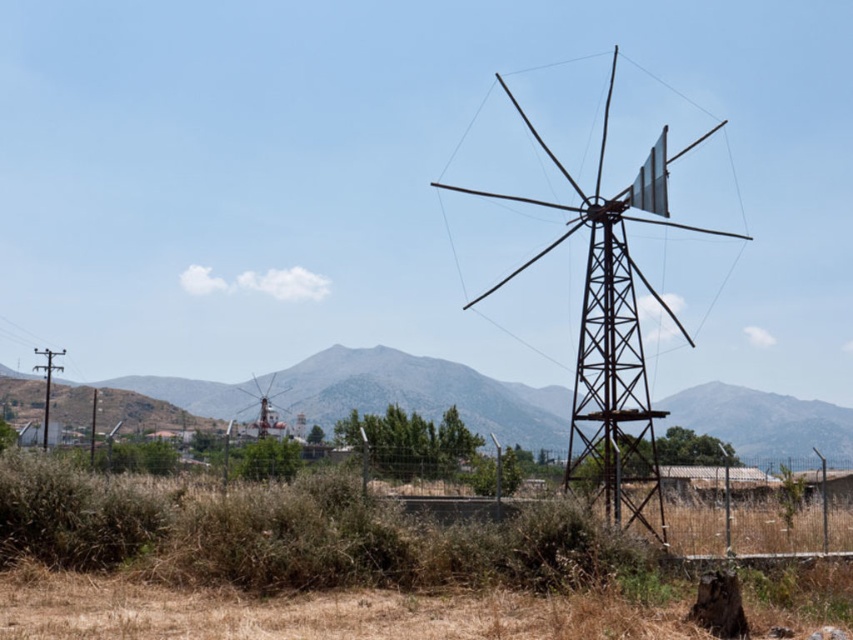
In the scene shown: You are standing at the edge of the scene and want to estimate the relative widths of the rustic stone mountain at center and the rusty metal windmill at center. Based on the information provided, which object is wider?

The rustic stone mountain at center might be wider than the rusty metal windmill at center according to the description.